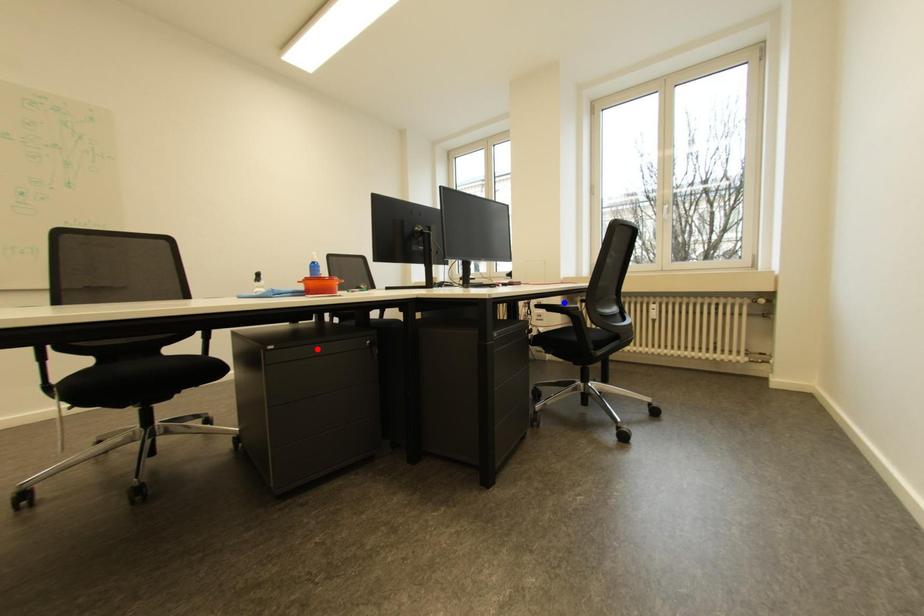
Question: In the image, two points are highlighted. Which point is nearer to the camera? Reply with the corresponding letter.

Choices:
 (A) blue point
 (B) red point

Answer: (B)